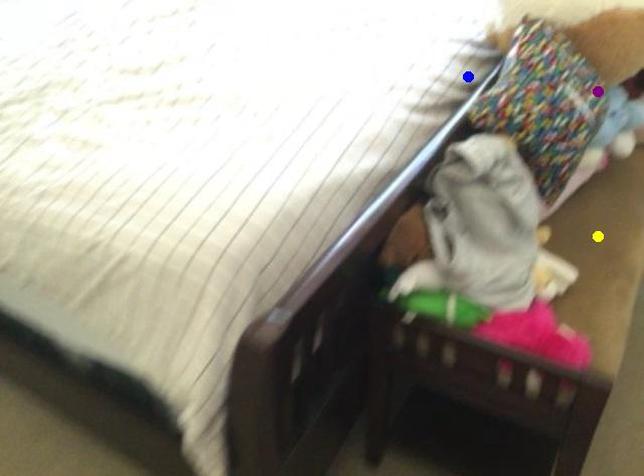
Order these from farthest to nearest:
yellow point
blue point
purple point

blue point
purple point
yellow point